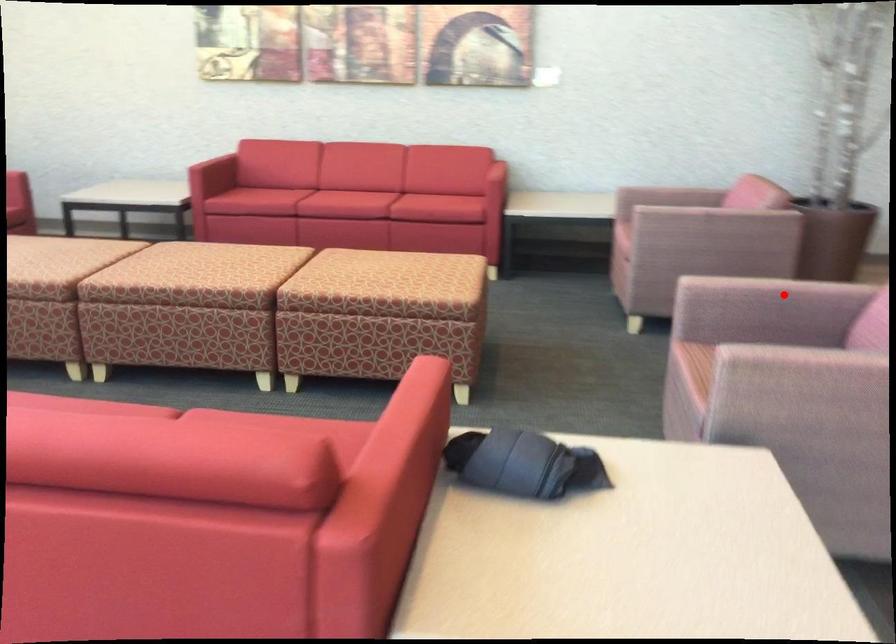
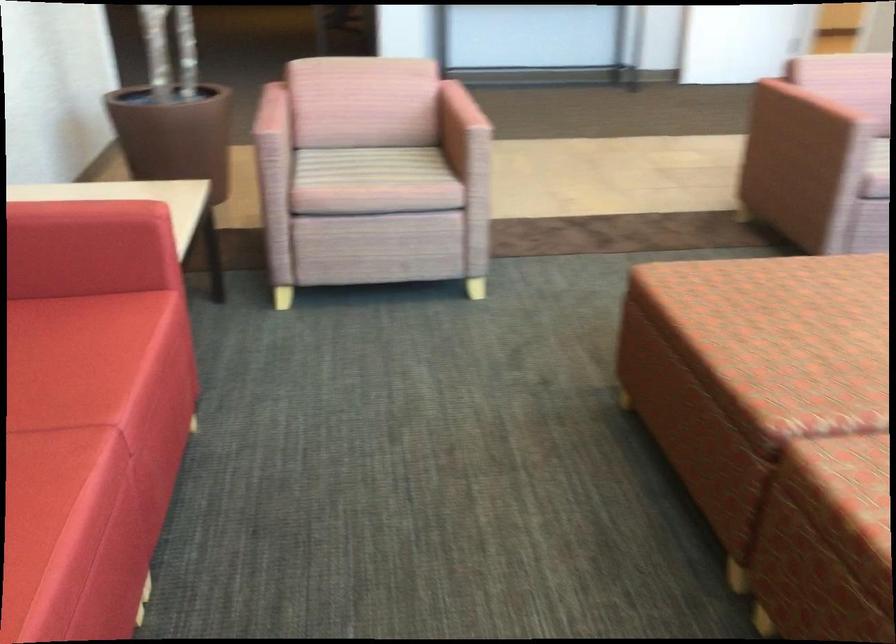
In the second image, find the point that corresponds to the highlighted location in the first image.

(810, 108)